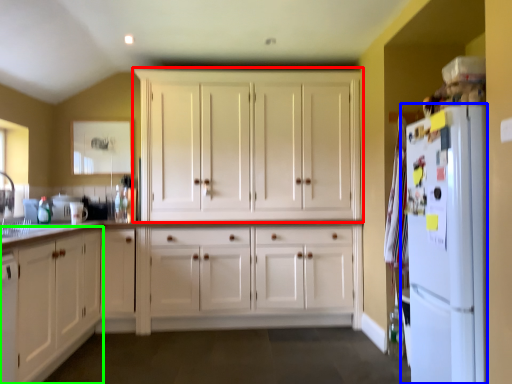
Question: Which object is the closest to the cabinetry (highlighted by a red box)? Choose among these: refrigerator (highlighted by a blue box) or cabinetry (highlighted by a green box).

Choices:
 (A) refrigerator
 (B) cabinetry

Answer: (B)